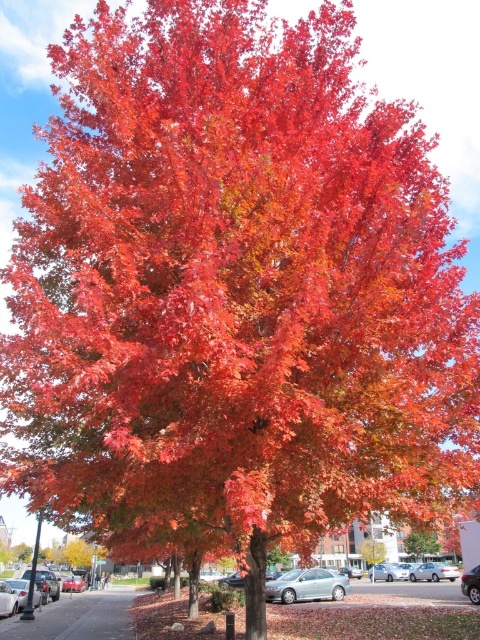
Question: Does satin silver sedan at center have a lesser width compared to shiny orange leaves at center?

Choices:
 (A) yes
 (B) no

Answer: (A)

Question: Does satin silver sedan at center have a lesser width compared to metallic silver car at center?

Choices:
 (A) no
 (B) yes

Answer: (A)

Question: Which object is closer to the camera taking this photo?

Choices:
 (A) satin silver sedan at lower center
 (B) metallic silver car at center

Answer: (A)

Question: Which point appears farthest from the camera in this image?

Choices:
 (A) (82, 577)
 (B) (429, 576)
 (C) (439, 545)

Answer: (A)

Question: Among these points, which one is nearest to the camera?

Choices:
 (A) (333, 573)
 (B) (66, 579)
 (C) (435, 576)

Answer: (A)

Question: Is shiny orange leaves at center to the left of metallic silver car at center from the viewer's perspective?

Choices:
 (A) no
 (B) yes

Answer: (A)